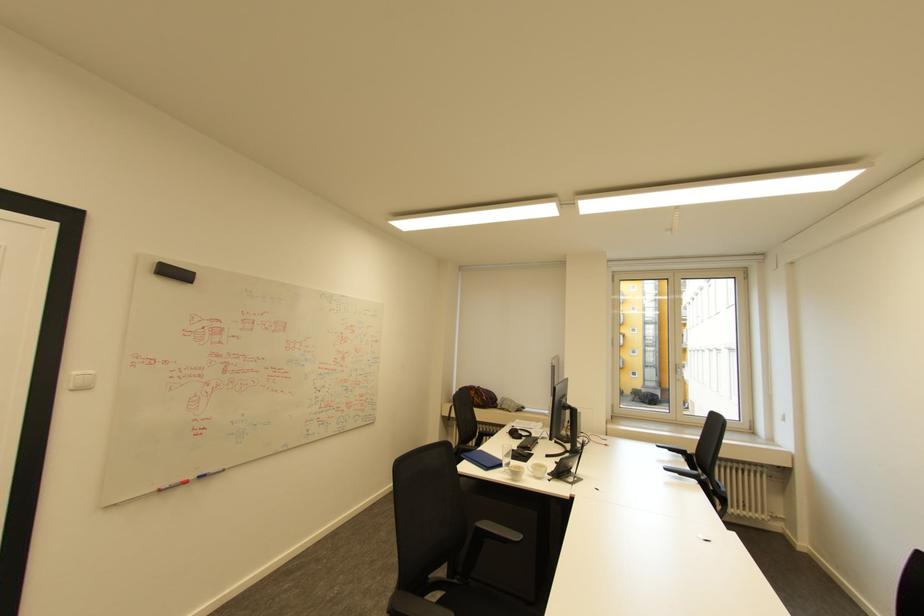
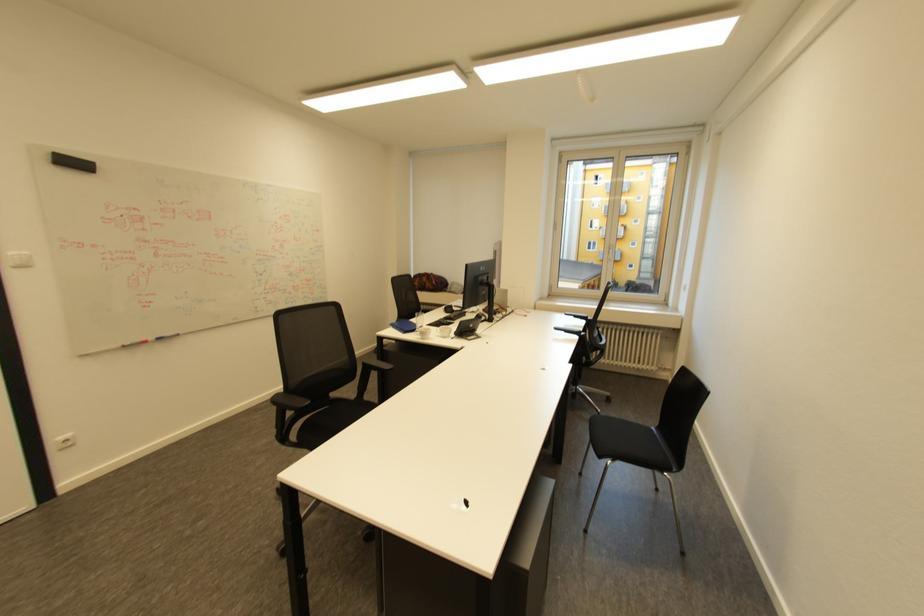
Where in the second image is the point corresponding to pixel 507 426 from the first image?

(448, 305)